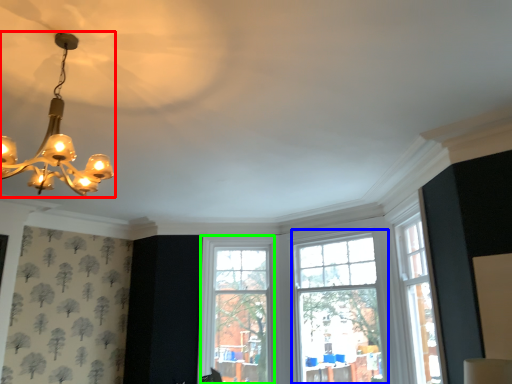
Question: Which object is positioned closest to lamp (highlighted by a red box)? Select from window (highlighted by a blue box) and window (highlighted by a green box).

Choices:
 (A) window
 (B) window

Answer: (A)